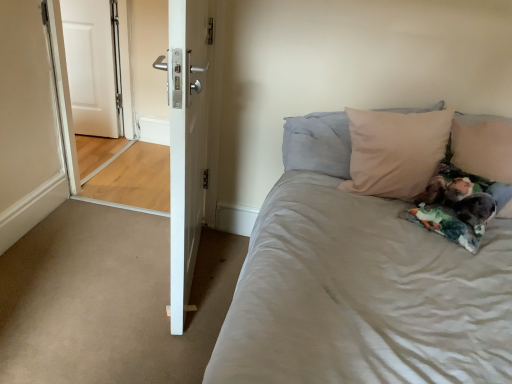
Question: Should I look upward or downward to see white glossy door at left?

Choices:
 (A) up
 (B) down

Answer: (A)

Question: Considering the relative sizes of beige fabric pillow at upper right, the second pillow when ordered from left to right, and white glossy door at left in the image provided, is beige fabric pillow at upper right, the second pillow when ordered from left to right, bigger than white glossy door at left?

Choices:
 (A) no
 (B) yes

Answer: (A)

Question: Is beige fabric pillow at upper right, the 1th pillow from the right, smaller than white glossy door at left?

Choices:
 (A) no
 (B) yes

Answer: (B)

Question: Is beige fabric pillow at upper right, the 1th pillow from the right, next to white glossy door at left and touching it?

Choices:
 (A) no
 (B) yes

Answer: (A)

Question: Is beige fabric pillow at upper right, the 1th pillow from the right, oriented towards white glossy door at left?

Choices:
 (A) yes
 (B) no

Answer: (B)

Question: From the image's perspective, is beige fabric pillow at upper right, the 1th pillow from the right, under white glossy door at left?

Choices:
 (A) no
 (B) yes

Answer: (B)

Question: Is beige fabric pillow at upper right, the 1th pillow from the right, facing away from white glossy door at left?

Choices:
 (A) yes
 (B) no

Answer: (A)

Question: Is white glossy door at left shorter than beige fabric pillow at upper right, the 1th pillow from the right?

Choices:
 (A) no
 (B) yes

Answer: (A)

Question: Is there a large distance between white glossy door at left and beige fabric pillow at upper right, the second pillow when ordered from left to right?

Choices:
 (A) yes
 (B) no

Answer: (A)

Question: Is white glossy door at left to the right of beige fabric pillow at upper right, the 1th pillow from the right, from the viewer's perspective?

Choices:
 (A) yes
 (B) no

Answer: (B)

Question: Is white glossy door at left behind beige fabric pillow at upper right, the second pillow when ordered from left to right?

Choices:
 (A) no
 (B) yes

Answer: (B)

Question: From the image's perspective, does white glossy door at left appear higher than beige fabric pillow at upper right, the 1th pillow from the right?

Choices:
 (A) no
 (B) yes

Answer: (B)

Question: From the image's perspective, is white glossy door at left below beige fabric pillow at upper right, the 1th pillow from the right?

Choices:
 (A) no
 (B) yes

Answer: (A)

Question: Is white glossy door at center, the first door when ordered from right to left, located within beige fabric pillow at upper right, the second pillow when ordered from left to right?

Choices:
 (A) yes
 (B) no

Answer: (B)